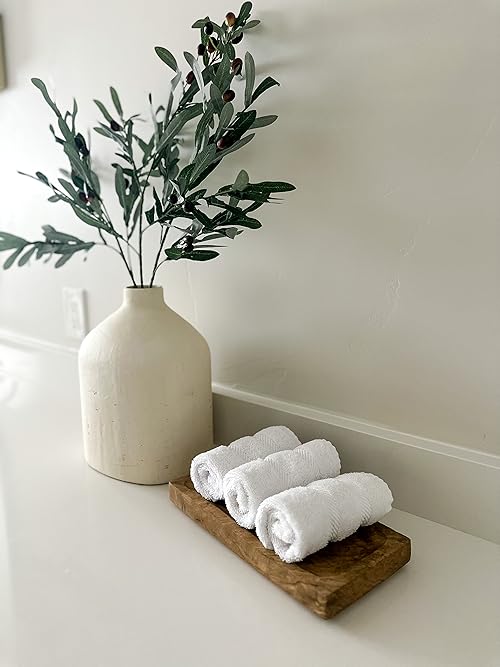
Identify the location of the left hand towel. The height and width of the screenshot is (667, 500). (297, 527).